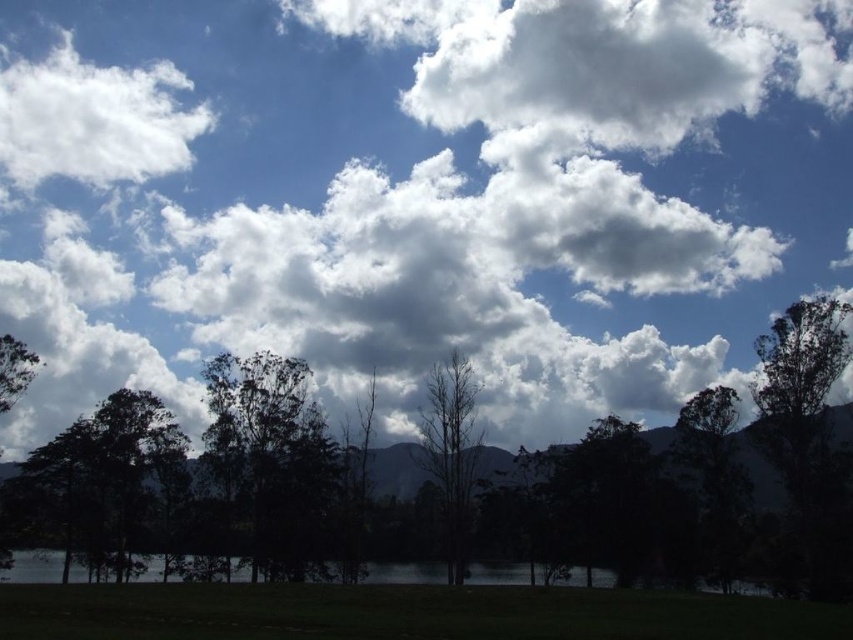
Looking at this image, you are an astronomer observing the sky. You notice two clouds in the image, the white fluffy clouds at upper center and the white fluffy cloud at upper left. Which cloud is closer to you?

The white fluffy clouds at upper center is closer to you because it is in front of the white fluffy cloud at upper left.

You are a bird flying at an altitude of 100 meters. You want to land on the bare wood tree at center. There is a white fluffy cloud at upper left in your path. Will you pass through the cloud before reaching the tree?

The white fluffy cloud at upper left is 75.72 meters away from the bare wood tree at center. Since you are flying at 100 meters altitude, you will pass above the cloud and reach the tree without obstruction.